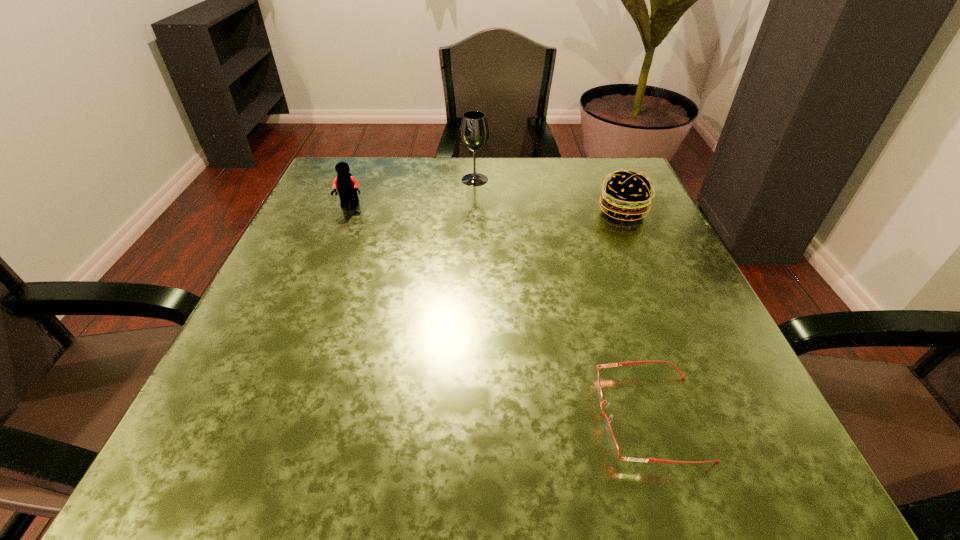
At what (x,y) coordinates should I click in order to perform the action: click on vacant area that lies between the third object from right to left and the patty. Please return your answer as a coordinate pair (x, y). The height and width of the screenshot is (540, 960). Looking at the image, I should click on (549, 195).

Where is `empty space between the spectacles and the leftmost object`? empty space between the spectacles and the leftmost object is located at coordinates (500, 311).

You are a GUI agent. You are given a task and a screenshot of the screen. Output one action in this format:
    pyautogui.click(x=<x>, y=<y>)
    Task: Click on the vacant space in between the shortest object and the Lego
    
    Given the screenshot: What is the action you would take?
    pyautogui.click(x=500, y=311)

Locate an element on the screen. unoccupied position between the shortest object and the tallest object is located at coordinates (563, 299).

This screenshot has height=540, width=960. Find the location of `free area in between the farthest object and the shortest object`. free area in between the farthest object and the shortest object is located at coordinates (563, 299).

What are the coordinates of `vacant region between the patty and the shortest object` in the screenshot? It's located at (636, 314).

Find the location of a particular element. This screenshot has width=960, height=540. free space between the farthest object and the Lego is located at coordinates (413, 192).

You are a GUI agent. You are given a task and a screenshot of the screen. Output one action in this format:
    pyautogui.click(x=<x>, y=<y>)
    Task: Click on the unoccupied position between the nearest object and the patty
    The width and height of the screenshot is (960, 540).
    Given the screenshot: What is the action you would take?
    pyautogui.click(x=636, y=314)

Identify the location of free spot between the leftmost object and the tallest object. The width and height of the screenshot is (960, 540). (413, 192).

Where is `object that stands as the closest to the Lego`? object that stands as the closest to the Lego is located at coordinates (474, 132).